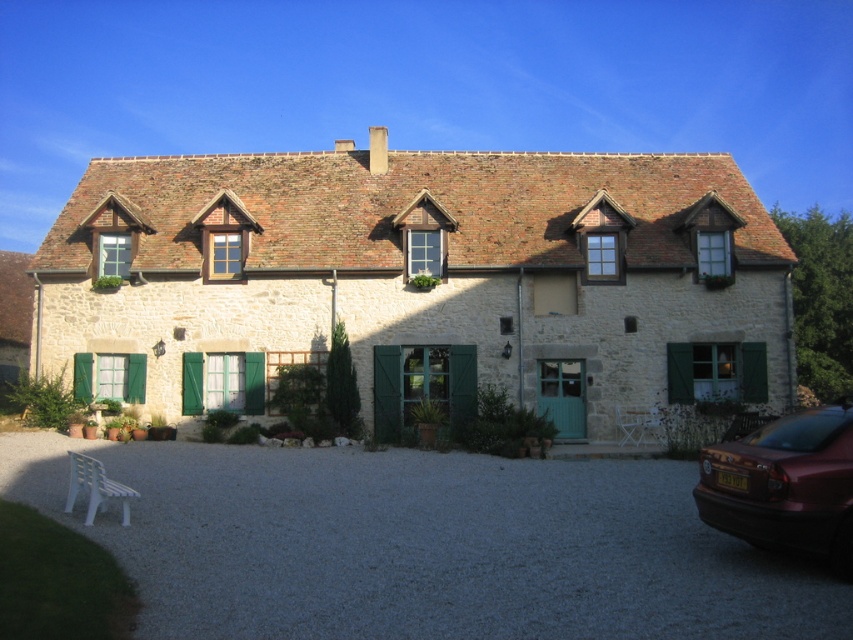
You are a delivery person approaching the house and need to park your vehicle. The shiny maroon sedan at lower right is already parked. Is there enough space on the gray gravel driveway at center to park another car?

The gray gravel driveway at center has a larger size compared to the shiny maroon sedan at lower right, so there is likely enough space to park another car of similar size.

You are a painter standing at a distance of 3 meters from the stone cottage at center. You want to paint the green wooden shutter at upper right without moving closer. Can you reach it with your 5 meter long paintbrush?

The stone cottage at center and green wooden shutter at upper right are 4.41 meters apart from each other. Since you are already 3 meters away from the stone cottage at center, the distance to the green wooden shutter at upper right would be 3 meters plus 4.41 meters, totaling 7.41 meters. Your paintbrush is only 5 meters long, so you cannot reach the green wooden shutter at upper right.